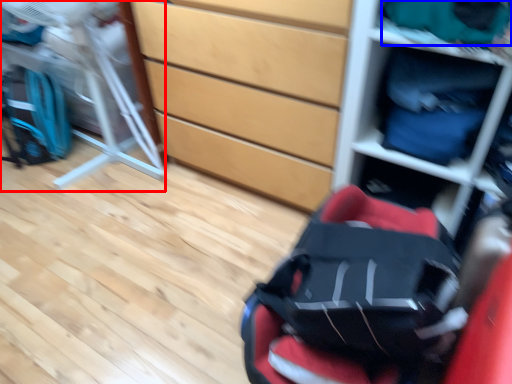
Question: Which of the following is the farthest to the observer, folding chair (highlighted by a red box) or clothing (highlighted by a blue box)?

Choices:
 (A) folding chair
 (B) clothing

Answer: (A)